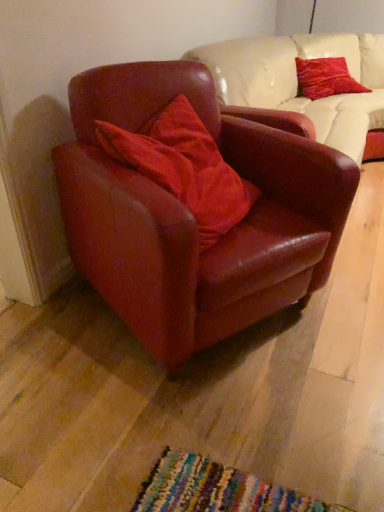
Question: From a real-world perspective, is satin red pillow at center, which appears as the 2th pillow when viewed from the right, below velvet red pillow at upper right, arranged as the 1th pillow when viewed from the right?

Choices:
 (A) no
 (B) yes

Answer: (A)

Question: Does satin red pillow at center, the second pillow viewed from the top, have a larger size compared to velvet red pillow at upper right, the 1th pillow viewed from the back?

Choices:
 (A) yes
 (B) no

Answer: (A)

Question: Is satin red pillow at center, the second pillow viewed from the top, outside of velvet red pillow at upper right, the 2th pillow in the left-to-right sequence?

Choices:
 (A) no
 (B) yes

Answer: (B)

Question: Is satin red pillow at center, which appears as the 2th pillow when viewed from the right, thinner than velvet red pillow at upper right, placed as the second pillow when sorted from bottom to top?

Choices:
 (A) yes
 (B) no

Answer: (B)

Question: Would you say satin red pillow at center, which appears as the 2th pillow when viewed from the right, contains velvet red pillow at upper right, arranged as the first pillow when viewed from the top?

Choices:
 (A) no
 (B) yes

Answer: (A)

Question: Is satin red pillow at center, the second pillow positioned from the back, positioned before velvet red pillow at upper right, arranged as the 1th pillow when viewed from the right?

Choices:
 (A) yes
 (B) no

Answer: (A)

Question: Is satin red pillow at center, which is the 1th pillow in bottom-to-top order, turned away from satin burgundy armchair at center?

Choices:
 (A) yes
 (B) no

Answer: (A)

Question: Considering the relative positions of satin red pillow at center, placed as the first pillow when sorted from left to right, and satin burgundy armchair at center in the image provided, is satin red pillow at center, placed as the first pillow when sorted from left to right, to the right of satin burgundy armchair at center from the viewer's perspective?

Choices:
 (A) yes
 (B) no

Answer: (B)

Question: Is satin burgundy armchair at center located within satin red pillow at center, the second pillow viewed from the top?

Choices:
 (A) yes
 (B) no

Answer: (B)

Question: Is satin red pillow at center, which is the 1th pillow in bottom-to-top order, bigger than satin burgundy armchair at center?

Choices:
 (A) no
 (B) yes

Answer: (A)

Question: From the image's perspective, is satin red pillow at center, placed as the first pillow when sorted from left to right, over satin burgundy armchair at center?

Choices:
 (A) yes
 (B) no

Answer: (A)

Question: Does satin red pillow at center, the second pillow positioned from the back, have a lesser width compared to satin burgundy armchair at center?

Choices:
 (A) no
 (B) yes

Answer: (B)

Question: Is satin burgundy armchair at center at the back of velvet red pillow at upper right, arranged as the 1th pillow when viewed from the right?

Choices:
 (A) yes
 (B) no

Answer: (B)